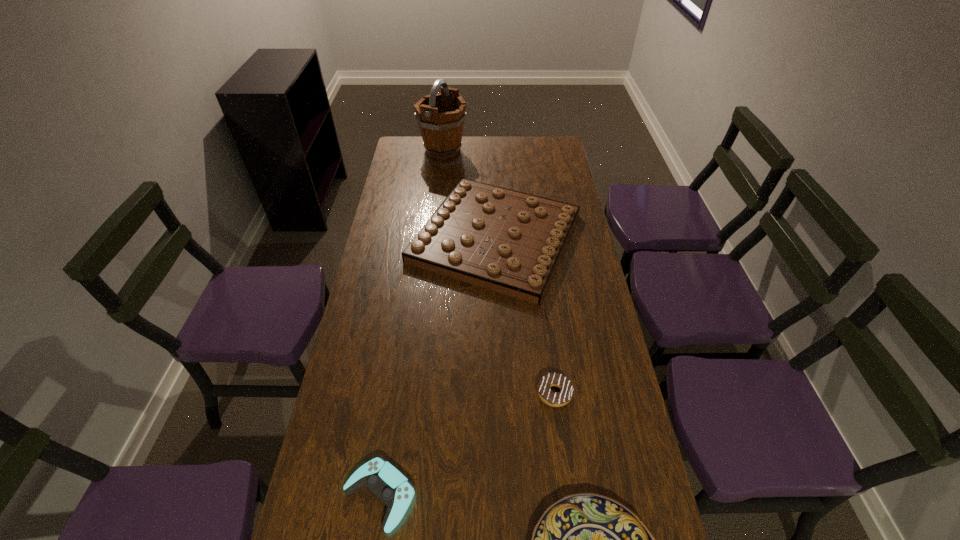
The height and width of the screenshot is (540, 960). Find the location of `vacant space located on the back of the third farthest object`. vacant space located on the back of the third farthest object is located at coordinates (548, 343).

Locate an element on the screen. object that is at the far edge is located at coordinates (441, 116).

At what (x,y) coordinates should I click in order to perform the action: click on bucket that is at the left edge. Please return your answer as a coordinate pair (x, y). The height and width of the screenshot is (540, 960). Looking at the image, I should click on (441, 116).

Identify the location of gameboard that is positioned at the left edge. This screenshot has height=540, width=960. (510, 242).

The height and width of the screenshot is (540, 960). Find the location of `control that is at the left edge`. control that is at the left edge is located at coordinates (390, 486).

The height and width of the screenshot is (540, 960). Find the location of `gameboard located at the right edge`. gameboard located at the right edge is located at coordinates (510, 242).

Find the location of a particular element. The width and height of the screenshot is (960, 540). doughnut present at the right edge is located at coordinates (x=559, y=399).

You are a GUI agent. You are given a task and a screenshot of the screen. Output one action in this format:
    pyautogui.click(x=<x>, y=<y>)
    Task: Click on the object that is positioned at the far left corner
    
    Given the screenshot: What is the action you would take?
    pyautogui.click(x=441, y=116)

At what (x,y) coordinates should I click in order to perform the action: click on vacant region at the far edge of the desktop. Please return your answer as a coordinate pair (x, y). Looking at the image, I should click on (518, 161).

Identify the location of vacant space at the left edge of the desktop. (369, 410).